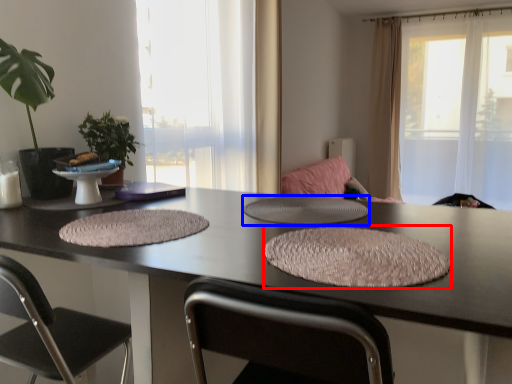
Question: Which of the following is the closest to the observer, yoga mat (highlighted by a red box) or round table (highlighted by a blue box)?

Choices:
 (A) yoga mat
 (B) round table

Answer: (A)